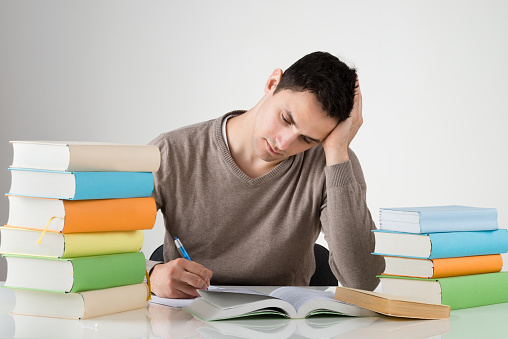
Identify the location of books on left. The image size is (508, 339). (125, 159), (125, 184), (126, 217), (122, 239), (121, 258), (125, 294).